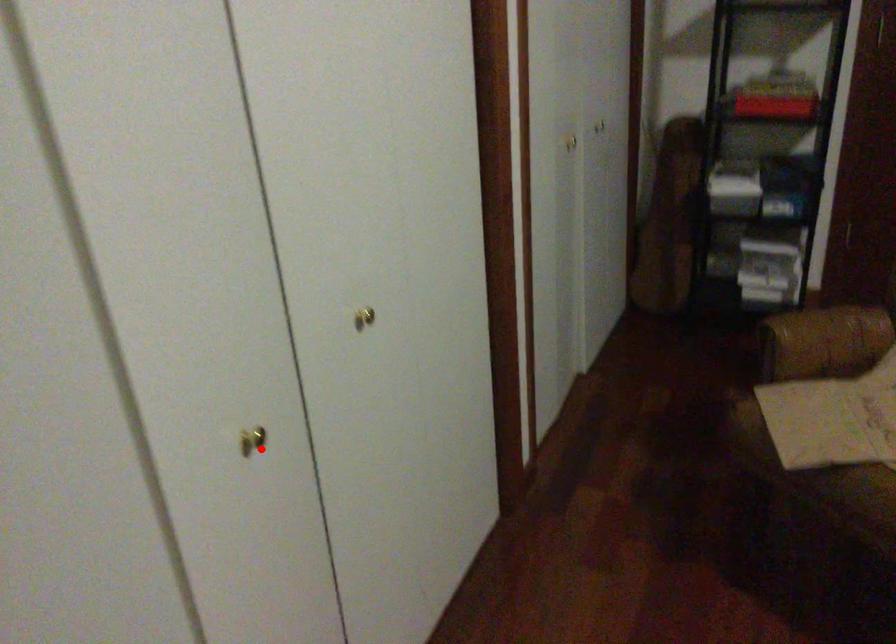
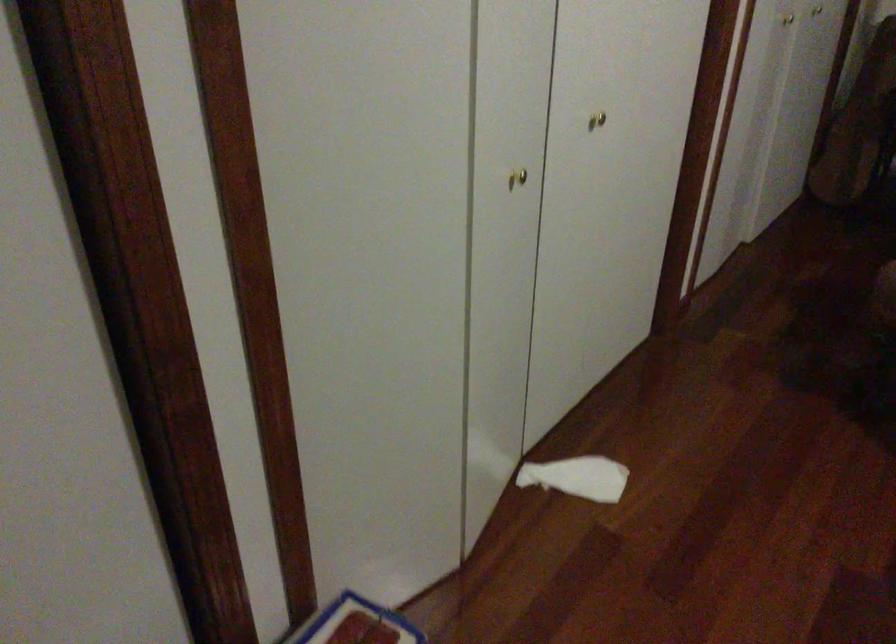
Where in the second image is the point corresponding to the highlighted location from the first image?

(517, 178)